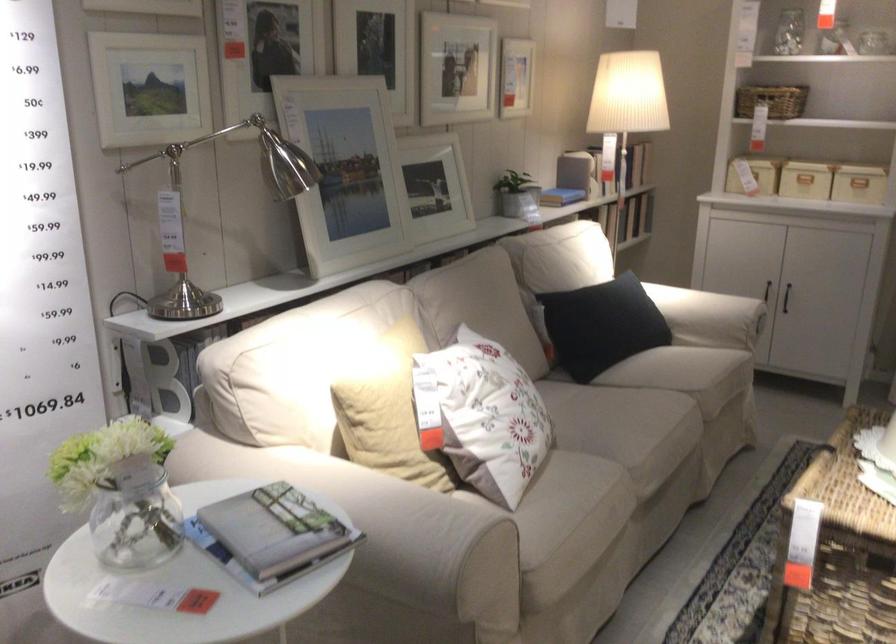
The location [600,325] corresponds to which object?

This point indicates the tan sofa pillow.